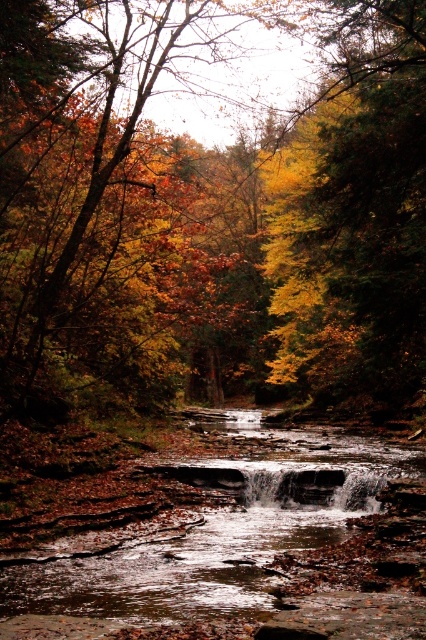
Is yellow/golden leaves at center wider than smooth rock stream at center?

Indeed, yellow/golden leaves at center has a greater width compared to smooth rock stream at center.

Which is more to the left, yellow/golden leaves at center or smooth rock stream at center?

yellow/golden leaves at center

Which is in front, point (25, 333) or point (328, 561)?

Positioned in front is point (328, 561).

You are a GUI agent. You are given a task and a screenshot of the screen. Output one action in this format:
    pyautogui.click(x=<x>, y=<y>)
    Task: Click on the yellow/golden leaves at center
    
    Given the screenshot: What is the action you would take?
    pyautogui.click(x=209, y=218)